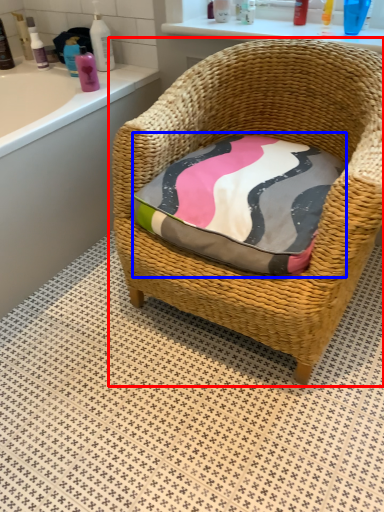
Question: Which object appears closest to the camera in this image, chair (highlighted by a red box) or throw pillow (highlighted by a blue box)?

Choices:
 (A) chair
 (B) throw pillow

Answer: (A)